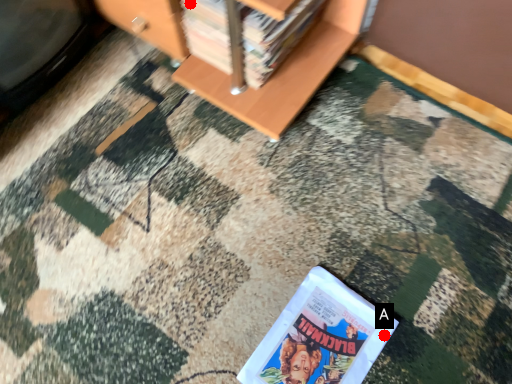
Question: Two points are circled on the image, labeled by A and B beside each circle. Which point is further to the camera?

Choices:
 (A) A is further
 (B) B is further

Answer: (B)